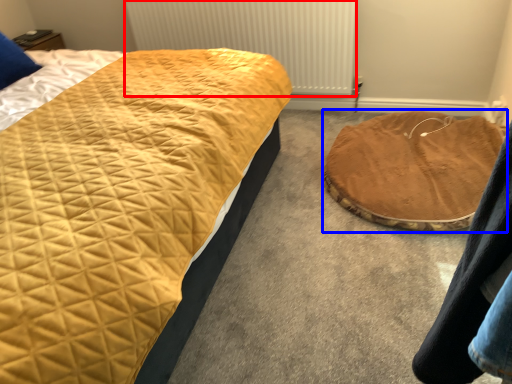
Question: Among these objects, which one is nearest to the camera, radiator (highlighted by a red box) or cat bed (highlighted by a blue box)?

Choices:
 (A) radiator
 (B) cat bed

Answer: (B)